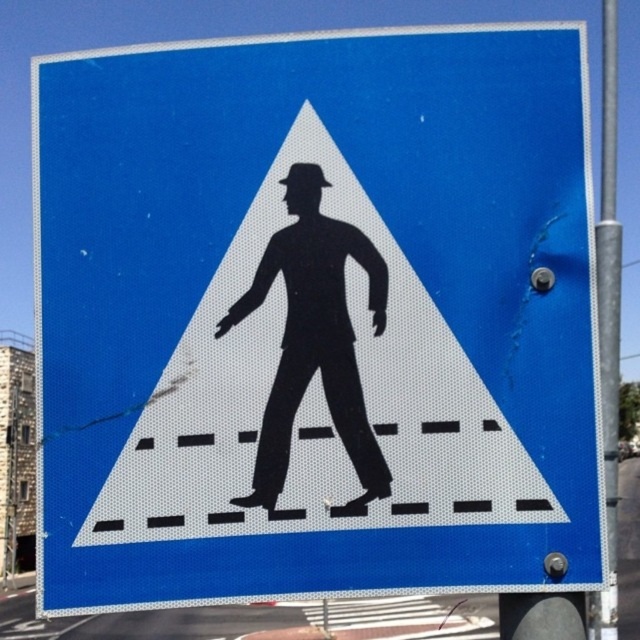
You are a city planner analyzing traffic signs. You see the black matte figure at center and the metallic gray pole at right. Which object takes up more area in the image?

The metallic gray pole at right takes up more area in the image because the black matte figure at center occupies less space than it.

You are a traffic engineer analyzing the pedestrian crossing sign. Where is the black matte figure at center located on the sign?

The black matte figure at center is located at point coordinates of (314,339) on the sign.